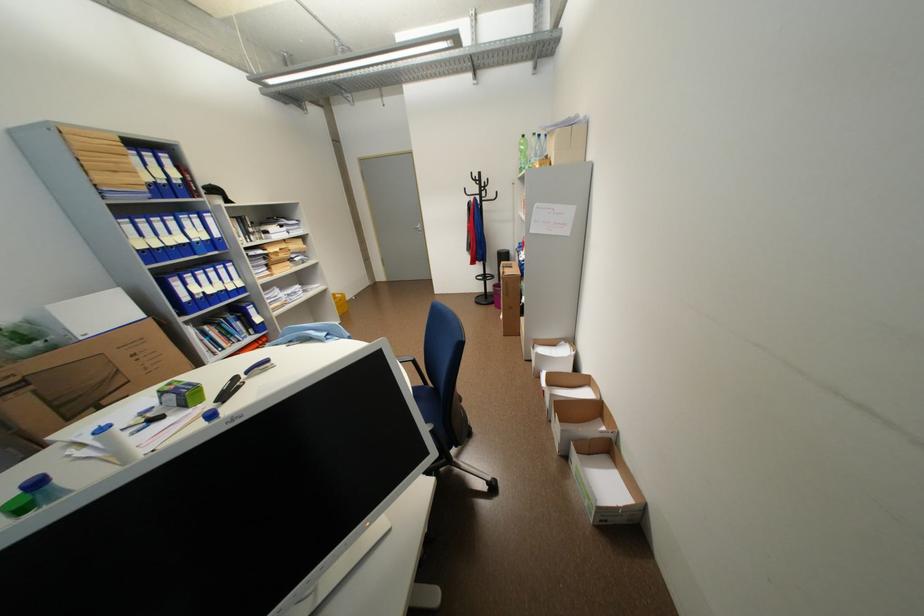
Identify the location of small green box. (179, 394).